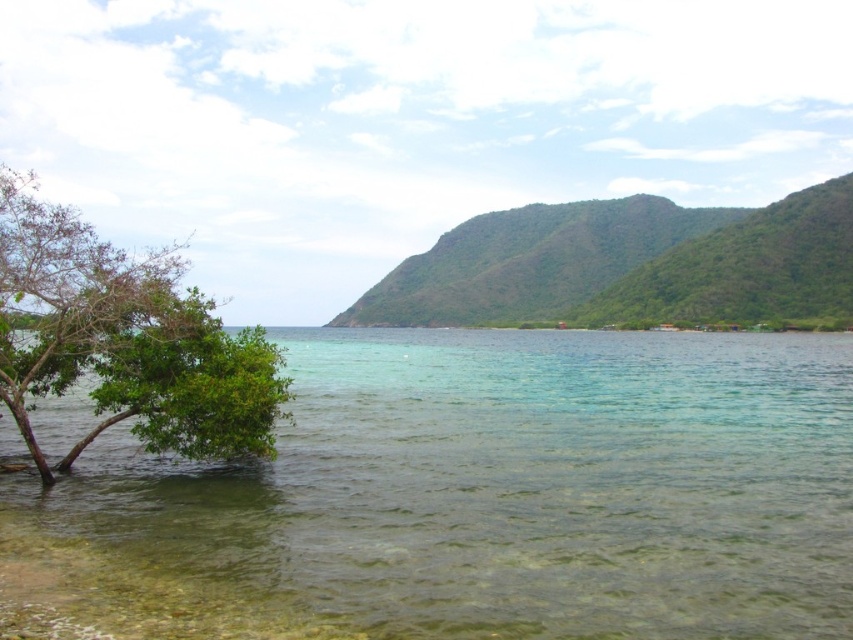
Which is below, clear water at lower left or green leafy tree at left?

clear water at lower left is lower down.

Based on the photo, between clear water at lower left and green leafy tree at left, which one has less height?

Standing shorter between the two is clear water at lower left.

Find the location of a particular element. This screenshot has height=640, width=853. clear water at lower left is located at coordinates (514, 486).